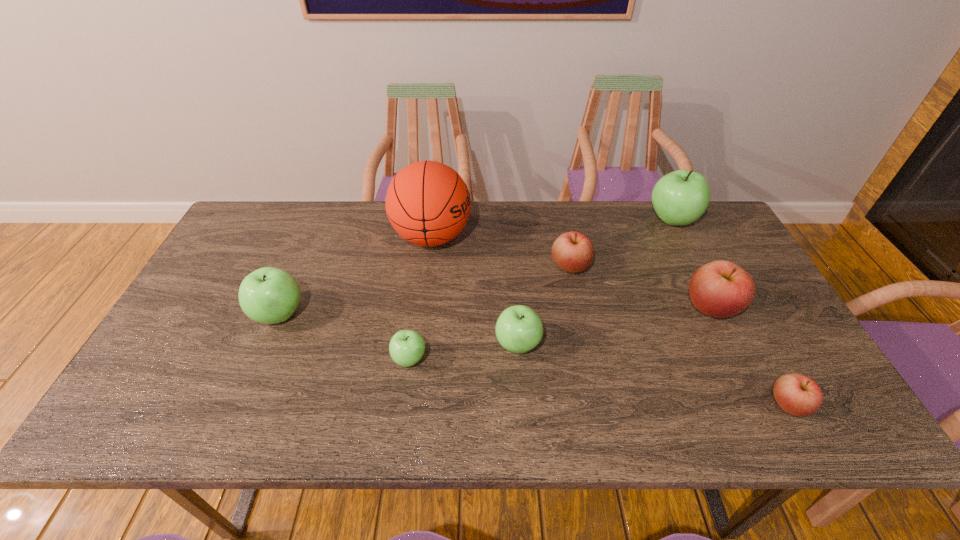
You are a GUI agent. You are given a task and a screenshot of the screen. Output one action in this format:
    pyautogui.click(x=<x>, y=<y>)
    Task: Click on the free space located on the left of the third green apple from right to left
    This screenshot has width=960, height=540.
    Given the screenshot: What is the action you would take?
    pyautogui.click(x=372, y=359)

The width and height of the screenshot is (960, 540). Find the location of `free space located 0.240m on the back of the nearest object`. free space located 0.240m on the back of the nearest object is located at coordinates (736, 308).

Find the location of `basketball present at the far edge`. basketball present at the far edge is located at coordinates [x=428, y=204].

The image size is (960, 540). Find the location of `apple that is at the far edge`. apple that is at the far edge is located at coordinates (679, 198).

Where is `object that is at the near edge`? Image resolution: width=960 pixels, height=540 pixels. object that is at the near edge is located at coordinates (799, 395).

Identify the location of object present at the far right corner. (679, 198).

The height and width of the screenshot is (540, 960). Find the location of `object present at the near right corner`. object present at the near right corner is located at coordinates tap(799, 395).

I want to click on free space at the far edge of the desktop, so click(x=499, y=213).

In the image, there is a desktop. Where is `free space at the near edge`? The height and width of the screenshot is (540, 960). free space at the near edge is located at coordinates (477, 403).

Locate an element on the screen. This screenshot has width=960, height=540. free region at the left edge is located at coordinates (209, 305).